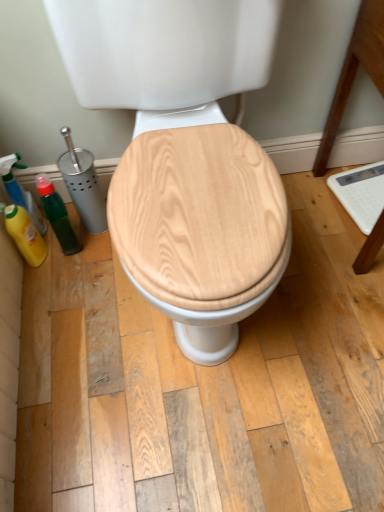
Identify the location of vacant area that lies in front of green matte bottle at left. (76, 288).